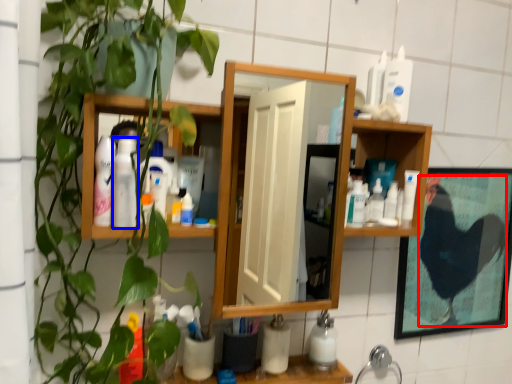
Question: Which point is further to the camera, chicken (highlighted by a red box) or toiletry (highlighted by a blue box)?

Choices:
 (A) chicken
 (B) toiletry

Answer: (A)